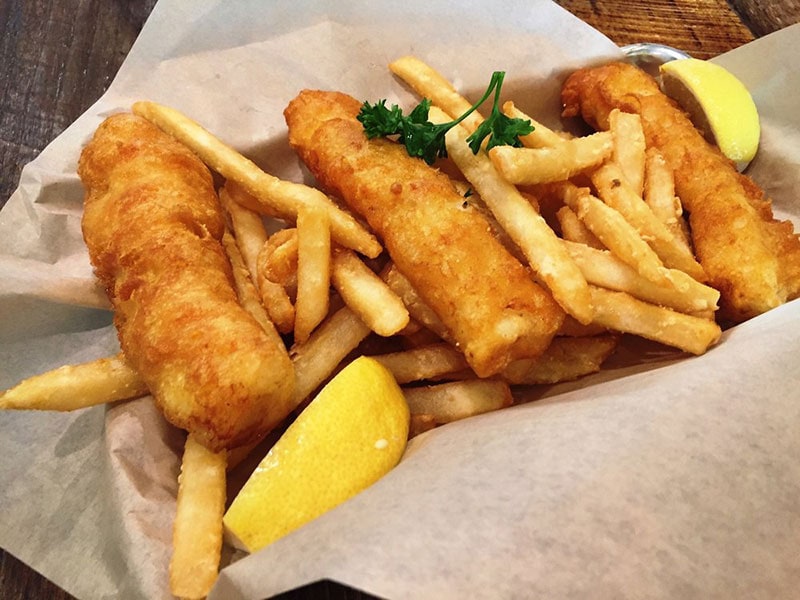
Locate an element on the screen. This screenshot has height=600, width=800. tray is located at coordinates (645, 54).